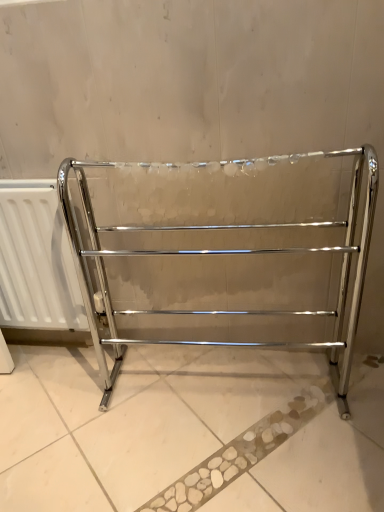
Question: Considering the relative positions of polished chrome towel rack at center and white matte radiator at left in the image provided, is polished chrome towel rack at center to the left or to the right of white matte radiator at left?

Choices:
 (A) left
 (B) right

Answer: (B)

Question: From the image's perspective, relative to white matte radiator at left, is polished chrome towel rack at center above or below?

Choices:
 (A) below
 (B) above

Answer: (A)

Question: From their relative heights in the image, would you say polished chrome towel rack at center is taller or shorter than white matte radiator at left?

Choices:
 (A) short
 (B) tall

Answer: (B)

Question: Is white matte radiator at left in front of or behind polished chrome towel rack at center in the image?

Choices:
 (A) behind
 (B) front

Answer: (A)

Question: Considering the positions of white matte radiator at left and polished chrome towel rack at center in the image, is white matte radiator at left wider or thinner than polished chrome towel rack at center?

Choices:
 (A) thin
 (B) wide

Answer: (A)

Question: Considering the positions of white matte radiator at left and polished chrome towel rack at center in the image, is white matte radiator at left taller or shorter than polished chrome towel rack at center?

Choices:
 (A) tall
 (B) short

Answer: (B)

Question: In the image, is white matte radiator at left on the left side or the right side of polished chrome towel rack at center?

Choices:
 (A) right
 (B) left

Answer: (B)